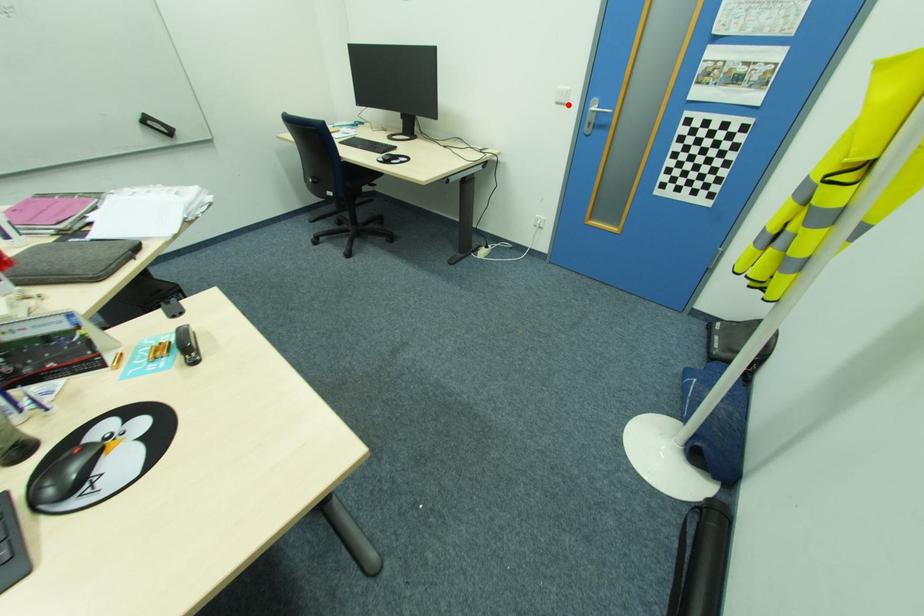
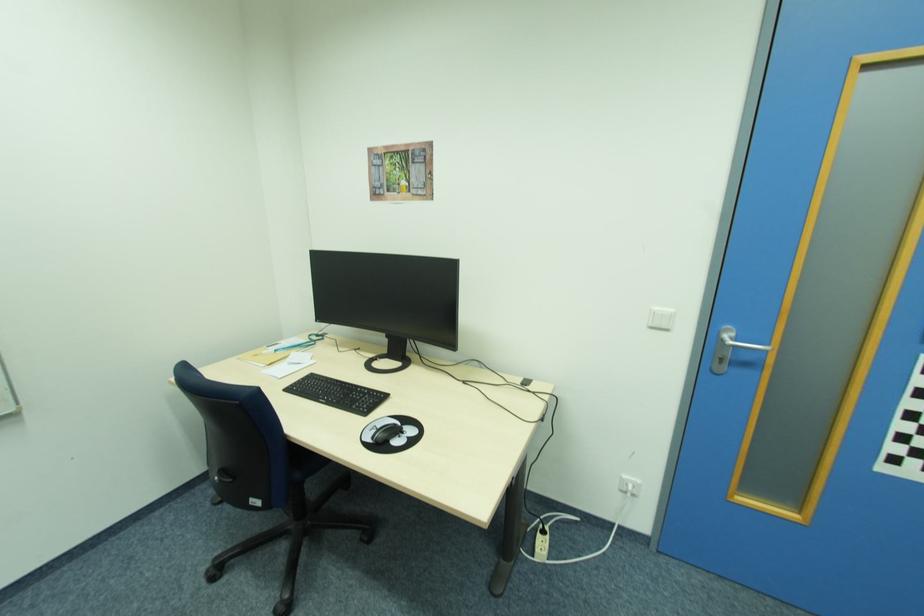
Where in the second image is the point corresponding to the highlighted location from the first image?

(670, 329)